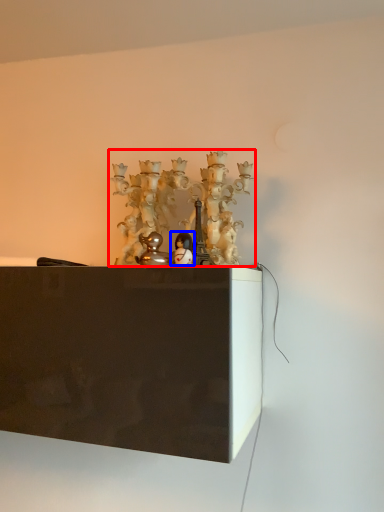
Question: Which object is further to the camera taking this photo, art (highlighted by a red box) or toy (highlighted by a blue box)?

Choices:
 (A) art
 (B) toy

Answer: (A)